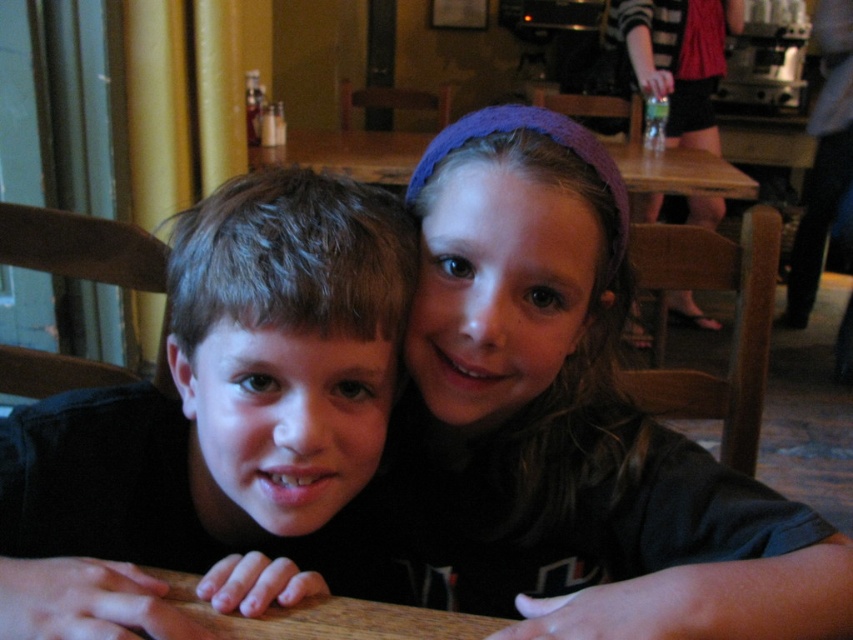
Is purple knitted headband at upper center below green plastic bottle at upper right?

Correct, purple knitted headband at upper center is located below green plastic bottle at upper right.

Where is `purple knitted headband at upper center`? The image size is (853, 640). purple knitted headband at upper center is located at coordinates (572, 420).

Does matte black shirt at center have a lesser width compared to green plastic bottle at upper right?

Indeed, matte black shirt at center has a lesser width compared to green plastic bottle at upper right.

The image size is (853, 640). What do you see at coordinates (219, 419) in the screenshot? I see `matte black shirt at center` at bounding box center [219, 419].

Identify the location of matte black shirt at center. This screenshot has width=853, height=640. (219, 419).

Does purple knitted headband at upper center have a smaller size compared to matte black shirt at center?

No, purple knitted headband at upper center is not smaller than matte black shirt at center.

Which is more to the left, purple knitted headband at upper center or matte black shirt at center?

matte black shirt at center

This screenshot has width=853, height=640. Describe the element at coordinates (572, 420) in the screenshot. I see `purple knitted headband at upper center` at that location.

Identify the location of purple knitted headband at upper center. Image resolution: width=853 pixels, height=640 pixels. (572, 420).